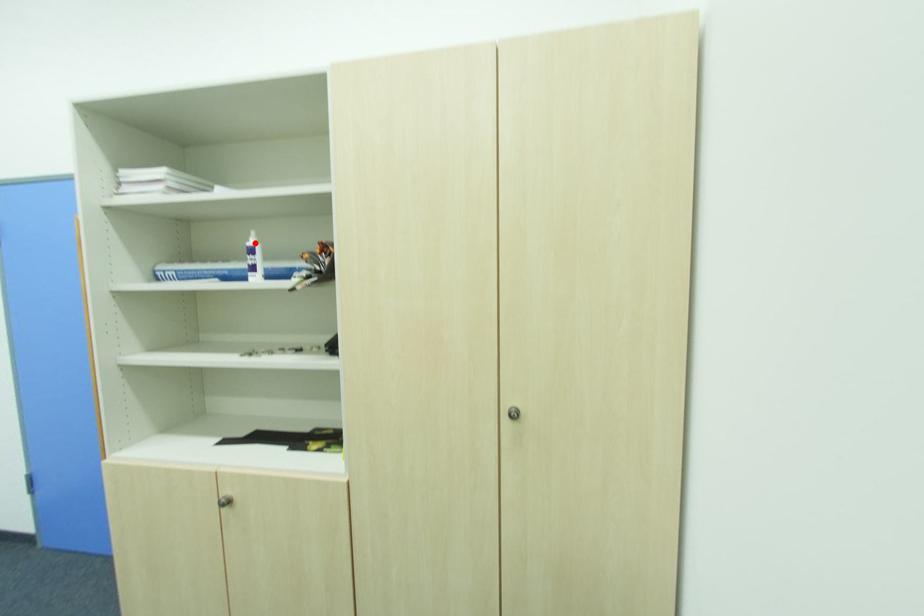
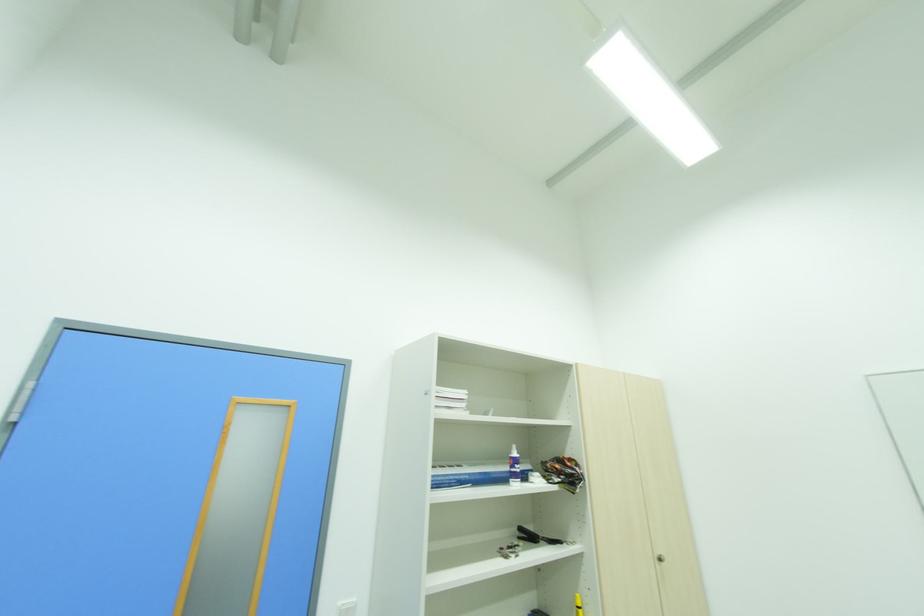
The point at the highlighted location is marked in the first image. Where is the corresponding point in the second image?

(517, 455)